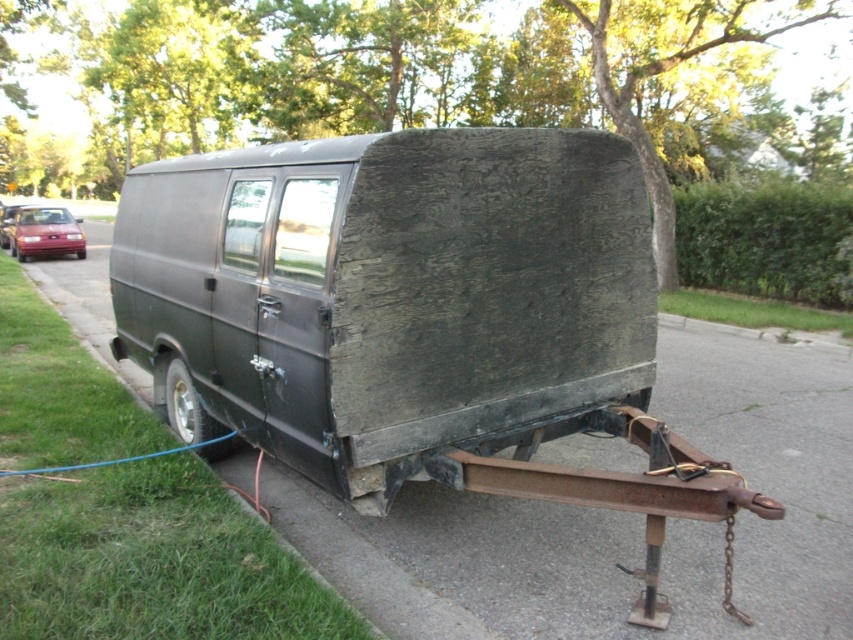
Is matte black van at center to the right of shiny red car at left from the viewer's perspective?

Indeed, matte black van at center is positioned on the right side of shiny red car at left.

Which of these two, matte black van at center or shiny red car at left, stands shorter?

shiny red car at left is shorter.

Is point (427, 456) in front of point (16, 234)?

Yes, point (427, 456) is in front of point (16, 234).

Locate an element on the screen. The image size is (853, 640). matte black van at center is located at coordinates (415, 316).